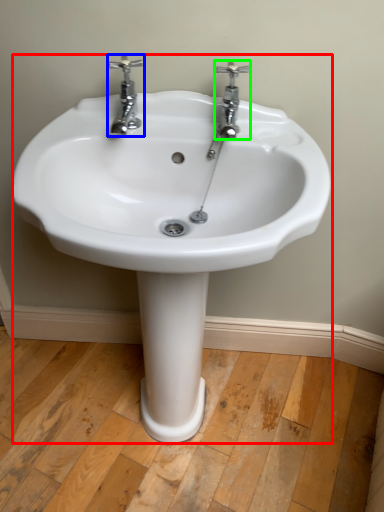
Question: Estimate the real-world distances between objects in this image. Which object is farther from sink (highlighted by a red box), tap (highlighted by a blue box) or tap (highlighted by a green box)?

Choices:
 (A) tap
 (B) tap

Answer: (B)